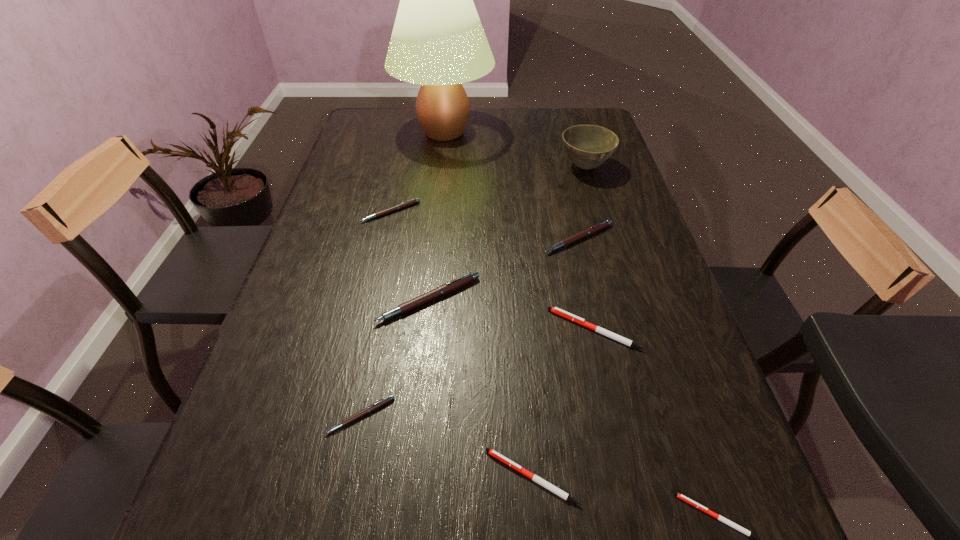
Where is `beige lampshade`? beige lampshade is located at coordinates (438, 41).

The height and width of the screenshot is (540, 960). What are the coordinates of `lampshade` in the screenshot? It's located at click(x=438, y=41).

Find the location of a particular element. This screenshot has height=540, width=960. the eighth shortest object is located at coordinates (588, 146).

Where is `the third tallest object`? The image size is (960, 540). the third tallest object is located at coordinates (452, 285).

Where is `the tallest pen`? the tallest pen is located at coordinates (452, 285).

I want to click on the fourth tallest object, so click(595, 228).

The width and height of the screenshot is (960, 540). I want to click on the second biggest pink pen, so click(x=595, y=228).

Where is `the second smallest pink pen`? Image resolution: width=960 pixels, height=540 pixels. the second smallest pink pen is located at coordinates (413, 201).

At what (x,y) coordinates should I click in order to perform the action: click on the farthest white pen. Please return your answer as a coordinate pair (x, y). Looking at the image, I should click on (567, 315).

In order to click on the third nearest object in this screenshot , I will do `click(374, 406)`.